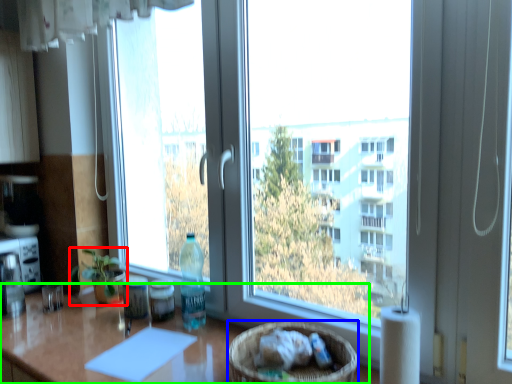
Question: Which is farther away from houseplant (highlighted by a red box)? basket (highlighted by a blue box) or table (highlighted by a green box)?

Choices:
 (A) basket
 (B) table

Answer: (A)